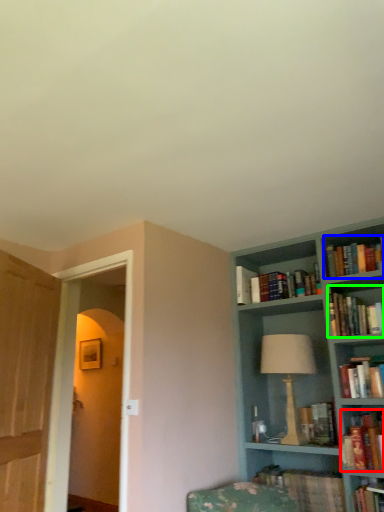
Question: Which object is positioned closest to book (highlighted by a red box)? Select from book (highlighted by a blue box) and book (highlighted by a green box).

Choices:
 (A) book
 (B) book

Answer: (B)